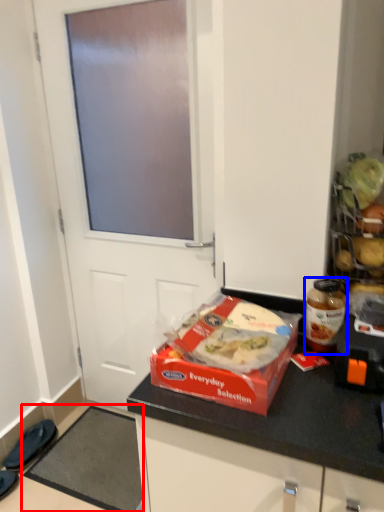
Question: Which object appears closest to the camera in this image, doormat (highlighted by a red box) or bottle (highlighted by a blue box)?

Choices:
 (A) doormat
 (B) bottle

Answer: (B)